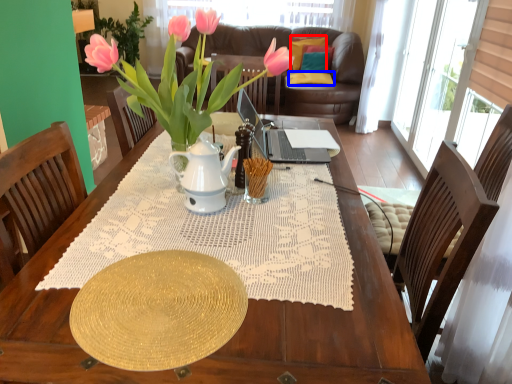
Question: Which object appears closest to the camera in this image, pillow (highlighted by a red box) or pillow (highlighted by a blue box)?

Choices:
 (A) pillow
 (B) pillow

Answer: (B)